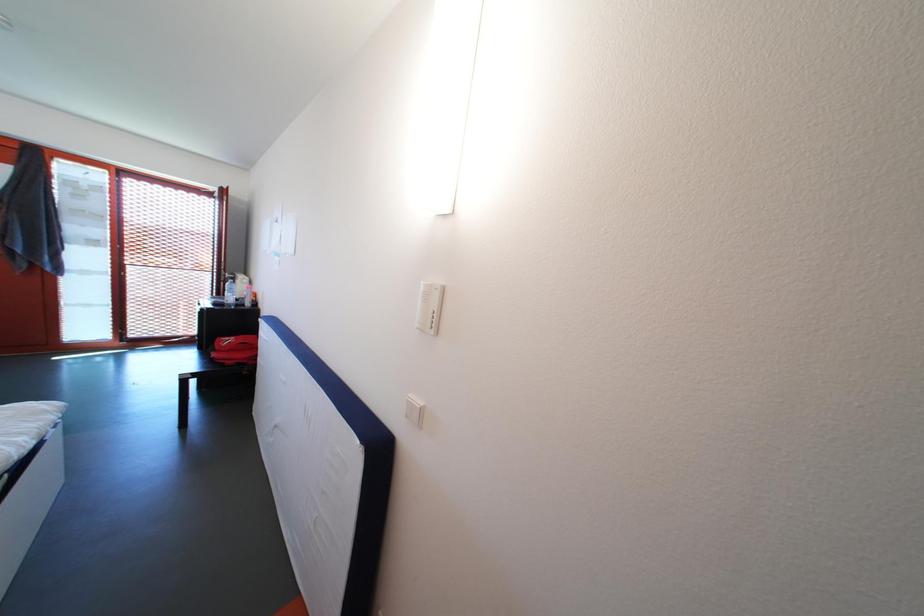
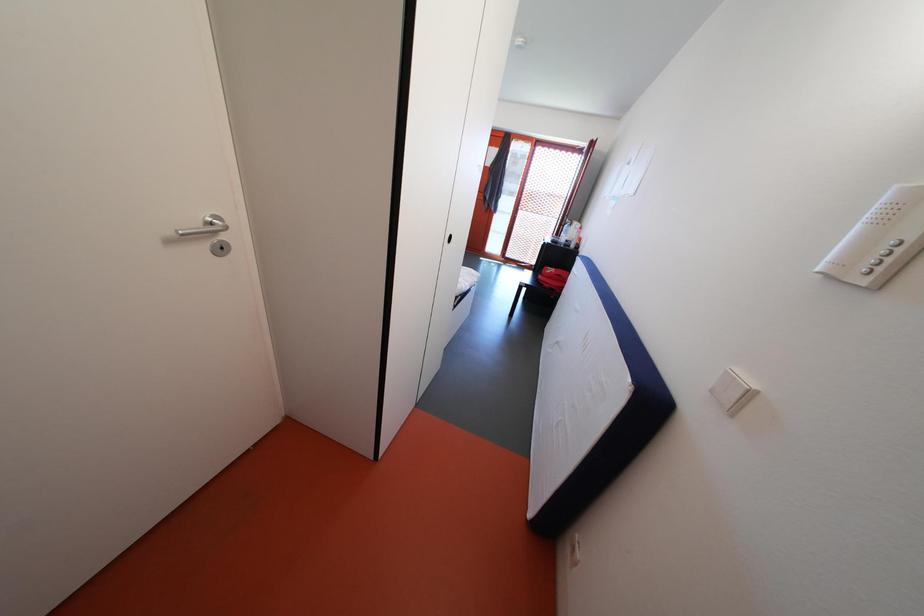
First-person continuous shooting, in which direction is the camera rotating?

The rotation direction of the camera is left-down.